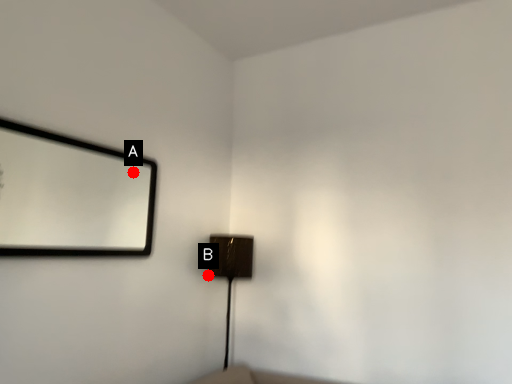
Question: Two points are circled on the image, labeled by A and B beside each circle. Which of the following is the farthest from the observer?

Choices:
 (A) A is further
 (B) B is further

Answer: (A)